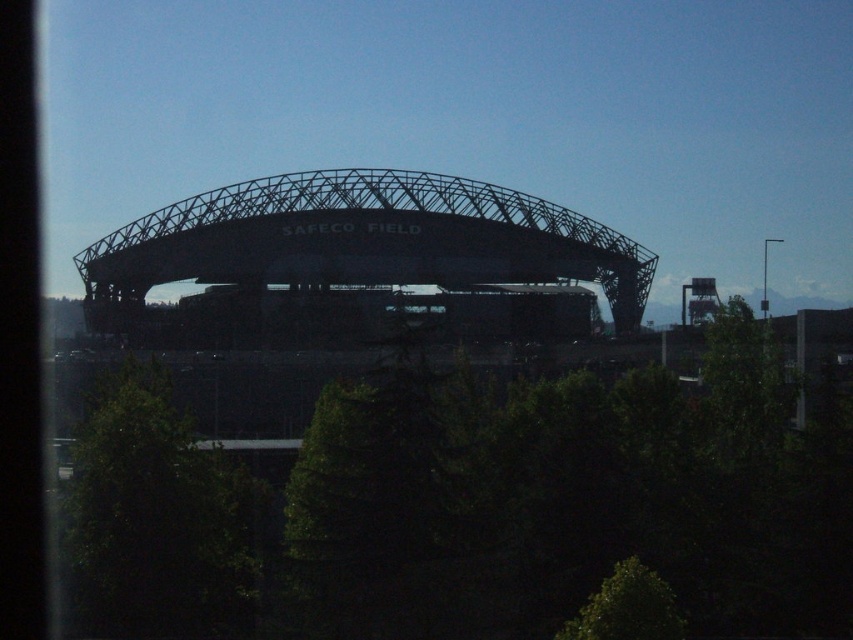
Is green leafy tree at right bigger than green leafy tree at lower center?

Indeed, green leafy tree at right has a larger size compared to green leafy tree at lower center.

This screenshot has height=640, width=853. What do you see at coordinates (744, 390) in the screenshot?
I see `green leafy tree at right` at bounding box center [744, 390].

Find the location of a particular element. The height and width of the screenshot is (640, 853). green leafy tree at right is located at coordinates (744, 390).

Who is lower down, green leafy tree at lower left or green leafy tree at right?

green leafy tree at lower left

Is green leafy tree at lower left below green leafy tree at right?

Yes.

Where is `green leafy tree at lower left`? The height and width of the screenshot is (640, 853). green leafy tree at lower left is located at coordinates (155, 522).

The height and width of the screenshot is (640, 853). I want to click on green leafy tree at lower left, so click(155, 522).

Can you confirm if green leafy tree at center is thinner than green leafy tree at right?

No, green leafy tree at center is not thinner than green leafy tree at right.

Consider the image. Which is above, green leafy tree at center or green leafy tree at right?

green leafy tree at right is above.

Which is behind, point (462, 440) or point (741, 426)?

Positioned behind is point (741, 426).

Image resolution: width=853 pixels, height=640 pixels. In order to click on green leafy tree at center in this screenshot , I will do `click(572, 499)`.